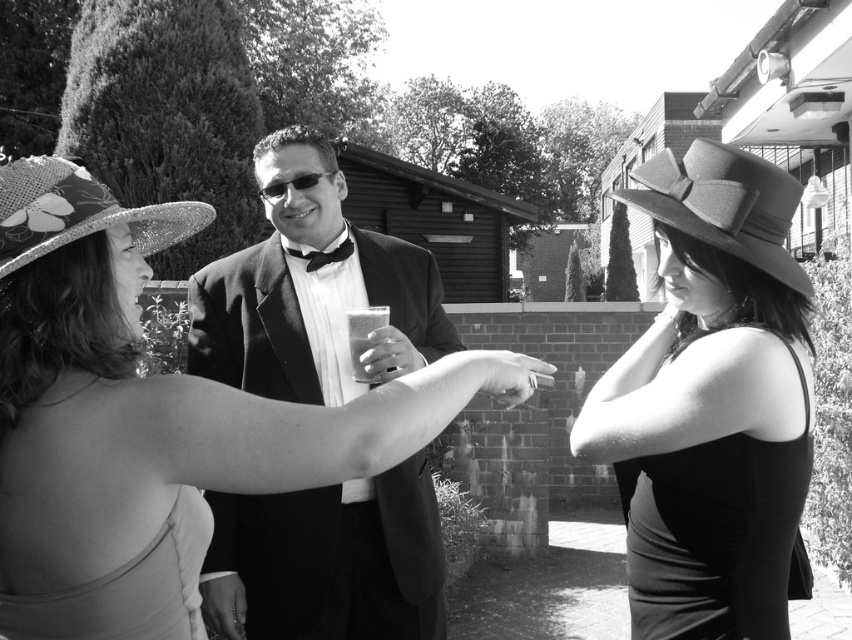
Is shiny fabric hat at center positioned behind matte black hat at right?

That is False.

Who is taller, shiny fabric hat at center or matte black hat at right?

Standing taller between the two is shiny fabric hat at center.

Is point (53, 422) behind point (718, 228)?

No, it is in front of (718, 228).

The height and width of the screenshot is (640, 852). I want to click on shiny fabric hat at center, so click(150, 420).

Does matte black hat at center have a smaller size compared to black satin bow tie at center?

Incorrect, matte black hat at center is not smaller in size than black satin bow tie at center.

Is point (799, 348) closer to camera compared to point (344, 253)?

Yes, point (799, 348) is closer to viewer.

Image resolution: width=852 pixels, height=640 pixels. In order to click on matte black hat at center in this screenshot , I will do `click(711, 401)`.

Locate an element on the screen. This screenshot has height=640, width=852. matte black hat at center is located at coordinates (711, 401).

Is point (254, 406) positioned before point (737, 529)?

Yes, it is in front of point (737, 529).

Measure the distance between shiny fabric hat at center and matte black hat at center.

The distance of shiny fabric hat at center from matte black hat at center is 26.13 inches.

At what (x,y) coordinates should I click in order to perform the action: click on shiny fabric hat at center. Please return your answer as a coordinate pair (x, y). Looking at the image, I should click on (150, 420).

The image size is (852, 640). Find the location of `shiny fabric hat at center`. shiny fabric hat at center is located at coordinates point(150,420).